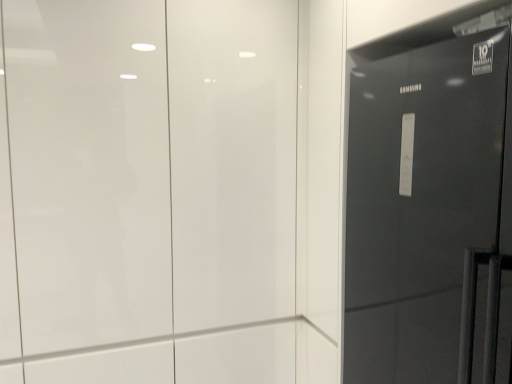
Locate an element on the screen. The width and height of the screenshot is (512, 384). glossy black refrigerator at right, which is the second door in left-to-right order is located at coordinates (421, 202).

What do you see at coordinates (421, 202) in the screenshot?
I see `glossy black refrigerator at right, which appears as the 1th door when viewed from the right` at bounding box center [421, 202].

Measure the distance between glossy black refrigerator at right, which appears as the 1th door when viewed from the right, and camera.

The distance of glossy black refrigerator at right, which appears as the 1th door when viewed from the right, from camera is 34.41 inches.

What are the coordinates of `white glossy door at upper center, the first door in the left-to-right sequence` in the screenshot? It's located at (151, 190).

Image resolution: width=512 pixels, height=384 pixels. What do you see at coordinates (151, 190) in the screenshot?
I see `white glossy door at upper center, acting as the 2th door starting from the right` at bounding box center [151, 190].

What are the coordinates of `glossy black refrigerator at right, which appears as the 1th door when viewed from the right` in the screenshot? It's located at (421, 202).

Does white glossy door at upper center, acting as the 2th door starting from the right, appear on the right side of glossy black refrigerator at right, which appears as the 1th door when viewed from the right?

Incorrect, white glossy door at upper center, acting as the 2th door starting from the right, is not on the right side of glossy black refrigerator at right, which appears as the 1th door when viewed from the right.

Is the position of white glossy door at upper center, the first door in the left-to-right sequence, more distant than that of glossy black refrigerator at right, which is the second door in left-to-right order?

Yes.

Which is closer, (282,128) or (443,108)?

Point (282,128) appears to be farther away from the viewer than point (443,108).

From the image's perspective, is white glossy door at upper center, acting as the 2th door starting from the right, below glossy black refrigerator at right, which is the second door in left-to-right order?

Actually, white glossy door at upper center, acting as the 2th door starting from the right, appears above glossy black refrigerator at right, which is the second door in left-to-right order, in the image.

From a real-world perspective, which object rests below the other?

glossy black refrigerator at right, which appears as the 1th door when viewed from the right, from a real-world perspective.

Which of these two, white glossy door at upper center, the first door in the left-to-right sequence, or glossy black refrigerator at right, which is the second door in left-to-right order, is thinner?

Thinner between the two is white glossy door at upper center, the first door in the left-to-right sequence.

Who is taller, white glossy door at upper center, the first door in the left-to-right sequence, or glossy black refrigerator at right, which appears as the 1th door when viewed from the right?

white glossy door at upper center, the first door in the left-to-right sequence, is taller.

Which of these two, white glossy door at upper center, the first door in the left-to-right sequence, or glossy black refrigerator at right, which is the second door in left-to-right order, is bigger?

Bigger between the two is white glossy door at upper center, the first door in the left-to-right sequence.

Is glossy black refrigerator at right, which is the second door in left-to-right order, inside white glossy door at upper center, the first door in the left-to-right sequence?

Actually, glossy black refrigerator at right, which is the second door in left-to-right order, is outside white glossy door at upper center, the first door in the left-to-right sequence.

Are white glossy door at upper center, acting as the 2th door starting from the right, and glossy black refrigerator at right, which is the second door in left-to-right order, beside each other?

white glossy door at upper center, acting as the 2th door starting from the right, is not next to glossy black refrigerator at right, which is the second door in left-to-right order, and they're not touching.

Is white glossy door at upper center, the first door in the left-to-right sequence, turned away from glossy black refrigerator at right, which is the second door in left-to-right order?

That's not correct — white glossy door at upper center, the first door in the left-to-right sequence, is not looking away from glossy black refrigerator at right, which is the second door in left-to-right order.

The height and width of the screenshot is (384, 512). I want to click on door that is on the left side of glossy black refrigerator at right, which appears as the 1th door when viewed from the right, so click(151, 190).

Considering the relative positions of glossy black refrigerator at right, which is the second door in left-to-right order, and white glossy door at upper center, the first door in the left-to-right sequence, in the image provided, is glossy black refrigerator at right, which is the second door in left-to-right order, to the left or to the right of white glossy door at upper center, the first door in the left-to-right sequence,?

glossy black refrigerator at right, which is the second door in left-to-right order, is to the right of white glossy door at upper center, the first door in the left-to-right sequence.

Does glossy black refrigerator at right, which is the second door in left-to-right order, lie in front of white glossy door at upper center, acting as the 2th door starting from the right?

That is True.

Is point (394, 200) closer or farther from the camera than point (137, 126)?

Point (394, 200) appears to be closer to the viewer than point (137, 126).

From the image's perspective, is glossy black refrigerator at right, which is the second door in left-to-right order, over white glossy door at upper center, acting as the 2th door starting from the right?

Incorrect, from the image's perspective, glossy black refrigerator at right, which is the second door in left-to-right order, is lower than white glossy door at upper center, acting as the 2th door starting from the right.

From a real-world perspective, who is located lower, glossy black refrigerator at right, which is the second door in left-to-right order, or white glossy door at upper center, the first door in the left-to-right sequence?

From a 3D spatial view, glossy black refrigerator at right, which is the second door in left-to-right order, is below.

Considering the relative sizes of glossy black refrigerator at right, which appears as the 1th door when viewed from the right, and white glossy door at upper center, acting as the 2th door starting from the right, in the image provided, is glossy black refrigerator at right, which appears as the 1th door when viewed from the right, thinner than white glossy door at upper center, acting as the 2th door starting from the right,?

No.

Is glossy black refrigerator at right, which is the second door in left-to-right order, taller or shorter than white glossy door at upper center, the first door in the left-to-right sequence?

Clearly, glossy black refrigerator at right, which is the second door in left-to-right order, is shorter compared to white glossy door at upper center, the first door in the left-to-right sequence.

In terms of size, does glossy black refrigerator at right, which is the second door in left-to-right order, appear bigger or smaller than white glossy door at upper center, the first door in the left-to-right sequence?

In the image, glossy black refrigerator at right, which is the second door in left-to-right order, appears to be smaller than white glossy door at upper center, the first door in the left-to-right sequence.

Is glossy black refrigerator at right, which is the second door in left-to-right order, not inside white glossy door at upper center, the first door in the left-to-right sequence?

Absolutely, glossy black refrigerator at right, which is the second door in left-to-right order, is external to white glossy door at upper center, the first door in the left-to-right sequence.

Is glossy black refrigerator at right, which appears as the 1th door when viewed from the right, not close to white glossy door at upper center, the first door in the left-to-right sequence?

That's not correct — glossy black refrigerator at right, which appears as the 1th door when viewed from the right, is a little close to white glossy door at upper center, the first door in the left-to-right sequence.

Is glossy black refrigerator at right, which appears as the 1th door when viewed from the right, aimed at white glossy door at upper center, acting as the 2th door starting from the right?

No, glossy black refrigerator at right, which appears as the 1th door when viewed from the right, is not turned towards white glossy door at upper center, acting as the 2th door starting from the right.

Identify the location of door located on the right of white glossy door at upper center, the first door in the left-to-right sequence. Image resolution: width=512 pixels, height=384 pixels. (421, 202).

Where is `door below the white glossy door at upper center, acting as the 2th door starting from the right (from a real-world perspective)`? door below the white glossy door at upper center, acting as the 2th door starting from the right (from a real-world perspective) is located at coordinates (421, 202).

Where is `door on the right side of white glossy door at upper center, acting as the 2th door starting from the right`? door on the right side of white glossy door at upper center, acting as the 2th door starting from the right is located at coordinates (421, 202).